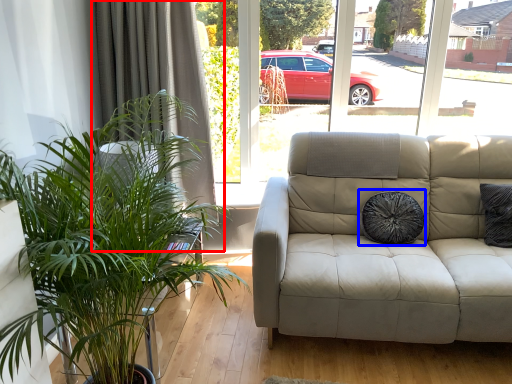
Question: Among these objects, which one is nearest to the camera, curtain (highlighted by a red box) or pillow (highlighted by a blue box)?

Choices:
 (A) curtain
 (B) pillow

Answer: (B)